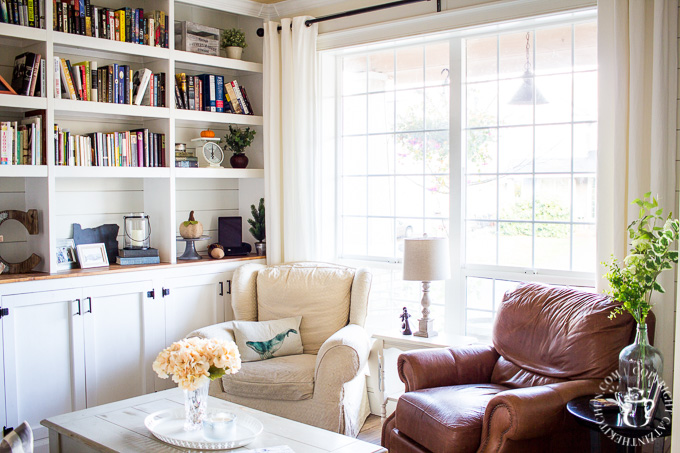
Locate an element on the screen. Image resolution: width=680 pixels, height=453 pixels. coffee table is located at coordinates (302, 439).